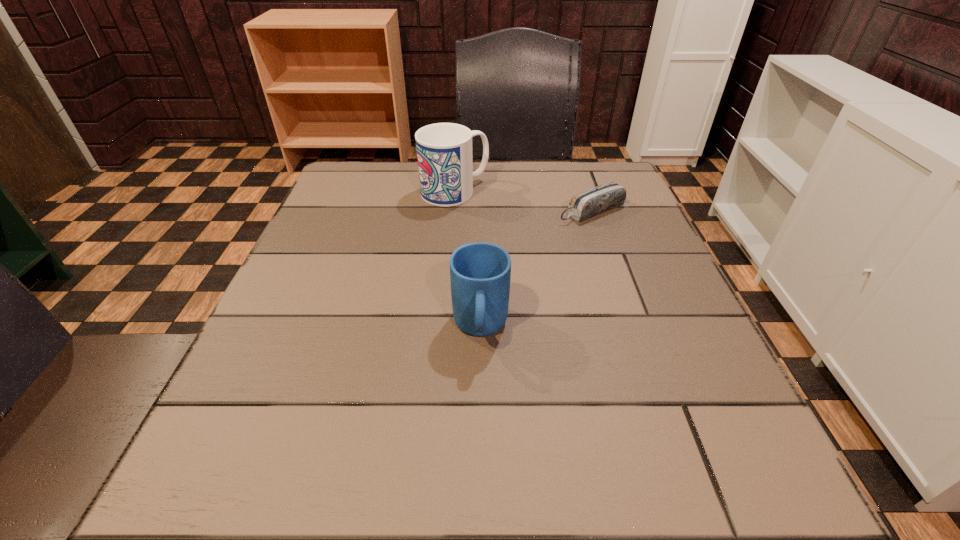
Identify the location of the farther mug. (444, 150).

Locate an element on the screen. the second tallest object is located at coordinates (480, 273).

Locate an element on the screen. This screenshot has width=960, height=540. the shorter mug is located at coordinates (480, 273).

Find the location of `the shortest object`. the shortest object is located at coordinates (591, 202).

This screenshot has height=540, width=960. Find the location of `the rightmost object`. the rightmost object is located at coordinates (591, 202).

This screenshot has height=540, width=960. I want to click on free spot located on the front of the farther mug, so click(x=446, y=300).

Where is `free space located 0.110m on the side of the second shortest object with the handle`? The image size is (960, 540). free space located 0.110m on the side of the second shortest object with the handle is located at coordinates (480, 424).

Locate an element on the screen. The image size is (960, 540). free space located 0.260m on the front of the pencil box is located at coordinates (626, 309).

Where is `mug that is at the far edge`? The height and width of the screenshot is (540, 960). mug that is at the far edge is located at coordinates (444, 150).

Where is `pencil box that is at the far edge`? This screenshot has height=540, width=960. pencil box that is at the far edge is located at coordinates pos(591,202).